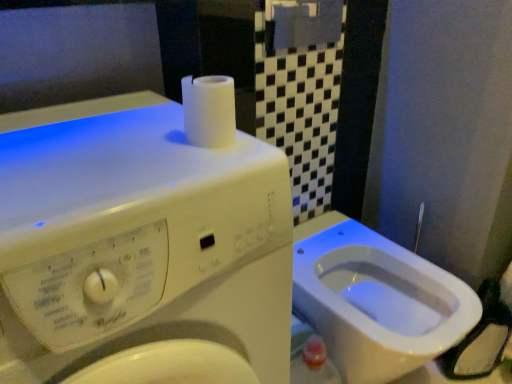
Question: Considering the relative sizes of white matte toilet paper at upper center and white glossy bidet at lower right in the image provided, is white matte toilet paper at upper center shorter than white glossy bidet at lower right?

Choices:
 (A) no
 (B) yes

Answer: (B)

Question: Is white matte toilet paper at upper center closer to camera compared to white glossy bidet at lower right?

Choices:
 (A) yes
 (B) no

Answer: (A)

Question: Is white matte toilet paper at upper center bigger than white glossy bidet at lower right?

Choices:
 (A) no
 (B) yes

Answer: (A)

Question: Is white matte toilet paper at upper center in contact with white glossy bidet at lower right?

Choices:
 (A) no
 (B) yes

Answer: (A)

Question: Considering the relative positions of white matte toilet paper at upper center and white glossy bidet at lower right in the image provided, is white matte toilet paper at upper center to the left of white glossy bidet at lower right from the viewer's perspective?

Choices:
 (A) yes
 (B) no

Answer: (A)

Question: Relative to white plastic washing machine at upper left, is white glossy bidet at lower right in front or behind?

Choices:
 (A) behind
 (B) front

Answer: (A)

Question: In terms of width, does white glossy bidet at lower right look wider or thinner when compared to white plastic washing machine at upper left?

Choices:
 (A) thin
 (B) wide

Answer: (A)

Question: Based on their positions, is white glossy bidet at lower right located to the left or right of white plastic washing machine at upper left?

Choices:
 (A) right
 (B) left

Answer: (A)

Question: Considering the positions of point (449, 273) and point (161, 349), is point (449, 273) closer or farther from the camera than point (161, 349)?

Choices:
 (A) farther
 (B) closer

Answer: (A)

Question: Is white plastic washing machine at upper left wider or thinner than white glossy bidet at lower right?

Choices:
 (A) thin
 (B) wide

Answer: (B)

Question: Is point (140, 135) closer or farther from the camera than point (309, 299)?

Choices:
 (A) farther
 (B) closer

Answer: (B)

Question: Is white plastic washing machine at upper left in front of or behind white glossy bidet at lower right in the image?

Choices:
 (A) behind
 (B) front

Answer: (B)

Question: Looking at the image, does white plastic washing machine at upper left seem bigger or smaller compared to white glossy bidet at lower right?

Choices:
 (A) big
 (B) small

Answer: (A)

Question: In terms of width, does white glossy bidet at lower right look wider or thinner when compared to white matte toilet paper at upper center?

Choices:
 (A) wide
 (B) thin

Answer: (A)

Question: From a real-world perspective, is white glossy bidet at lower right physically located above or below white matte toilet paper at upper center?

Choices:
 (A) above
 (B) below

Answer: (B)